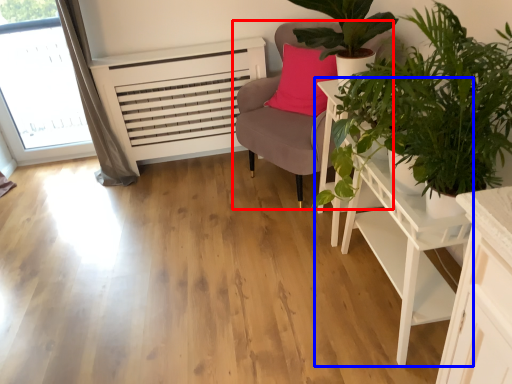
Question: Which object is further to the camera taking this photo, chair (highlighted by a red box) or table (highlighted by a blue box)?

Choices:
 (A) chair
 (B) table

Answer: (A)